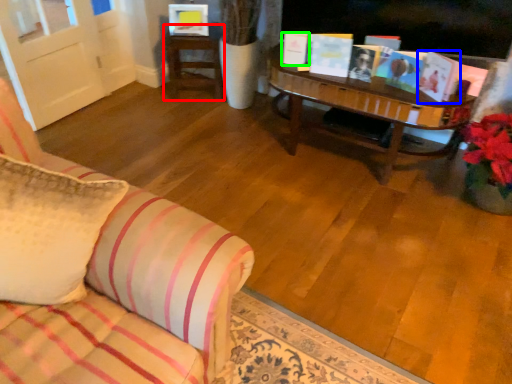
Question: Which object is positioned closest to table (highlighted by a red box)? Select from book (highlighted by a blue box) and book (highlighted by a green box).

Choices:
 (A) book
 (B) book

Answer: (B)